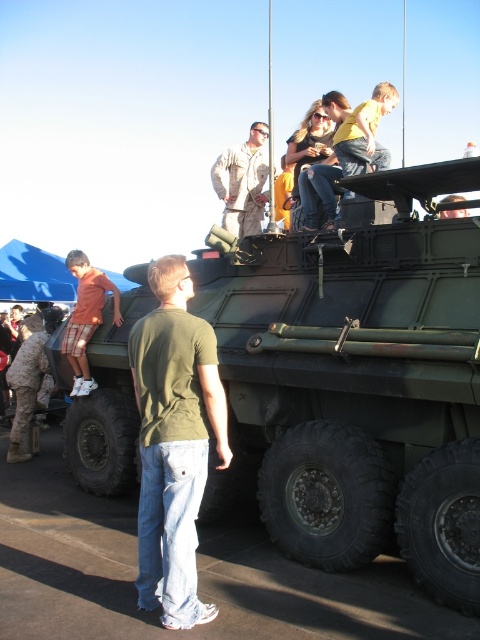
Can you confirm if green cotton shirt at center is positioned above camouflage fabric uniform at center?

No, green cotton shirt at center is not above camouflage fabric uniform at center.

Does green cotton shirt at center have a greater width compared to camouflage fabric uniform at center?

No, green cotton shirt at center is not wider than camouflage fabric uniform at center.

The image size is (480, 640). In order to click on green cotton shirt at center in this screenshot , I will do `click(173, 442)`.

Describe the element at coordinates (242, 182) in the screenshot. I see `camouflage fabric uniform at center` at that location.

In the scene shown: Between camouflage fabric uniform at center and matte red shorts at left, which one has less height?

With less height is matte red shorts at left.

Who is more distant from viewer, (x=248, y=186) or (x=90, y=323)?

The point (x=248, y=186) is more distant.

This screenshot has width=480, height=640. Find the location of `camouflage fabric uniform at center`. camouflage fabric uniform at center is located at coordinates (242, 182).

Can you confirm if green matte tank at upper center is positioned to the right of matte red shorts at left?

Correct, you'll find green matte tank at upper center to the right of matte red shorts at left.

Can you confirm if green matte tank at upper center is smaller than matte red shorts at left?

No, green matte tank at upper center is not smaller than matte red shorts at left.

The height and width of the screenshot is (640, 480). Describe the element at coordinates (357, 381) in the screenshot. I see `green matte tank at upper center` at that location.

At what (x,y) coordinates should I click in order to perform the action: click on green matte tank at upper center. Please return your answer as a coordinate pair (x, y). The width and height of the screenshot is (480, 640). Looking at the image, I should click on (x=357, y=381).